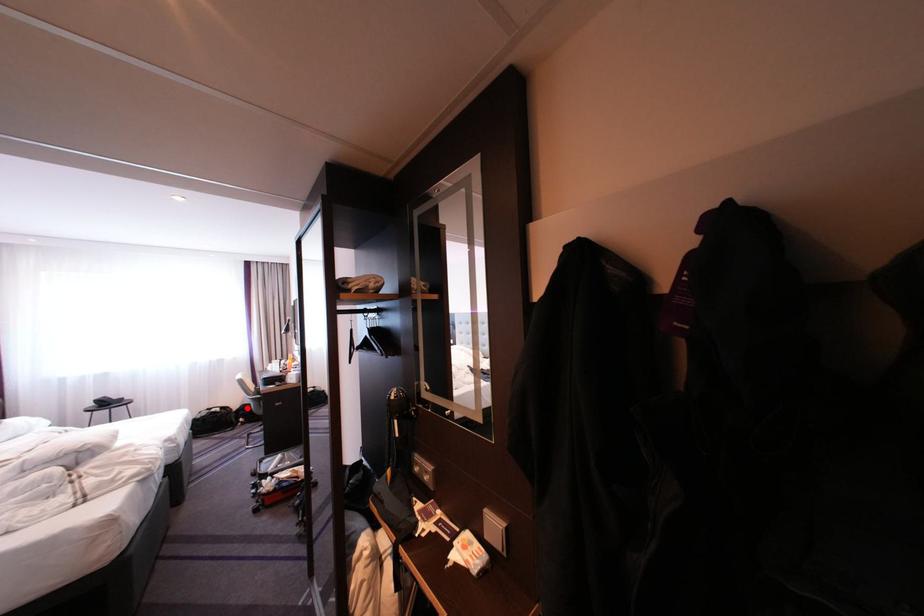
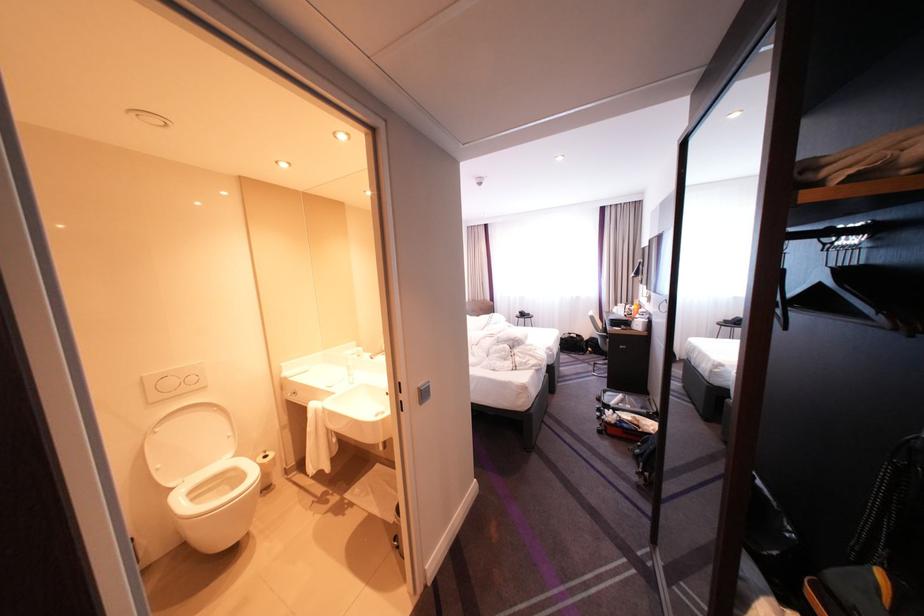
Question: I am providing you with two images of the same scene from different viewpoints. Given a red point in image1, look at the same physical point in image2. Is it:

Choices:
 (A) Closer to the viewpoint
 (B) Farther from the viewpoint

Answer: (A)